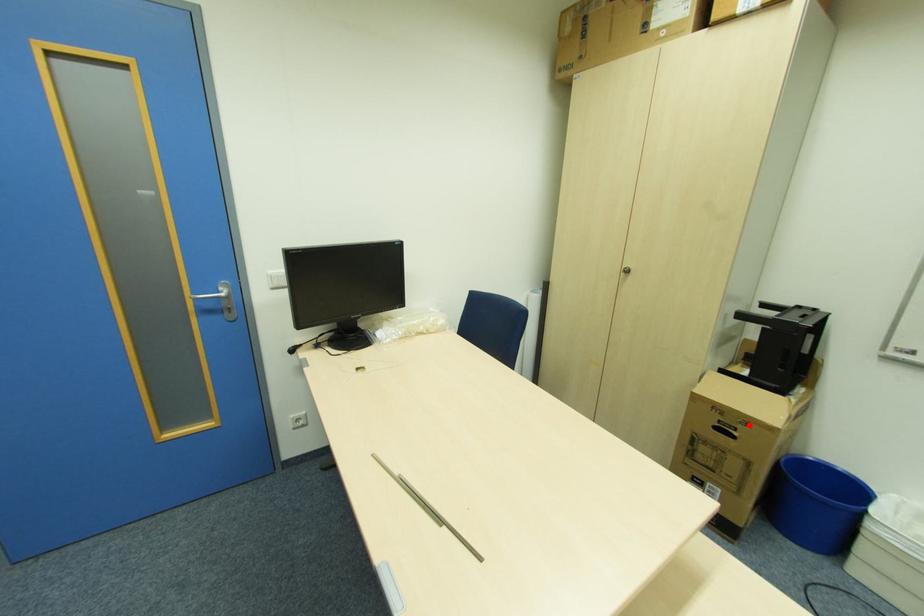
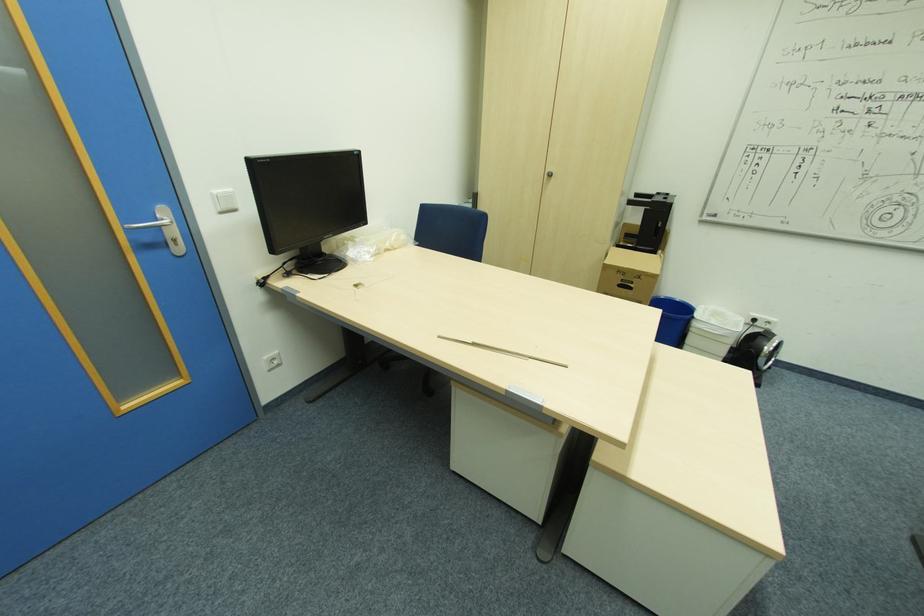
Where in the second image is the point corresponding to the highlighted location from the first image?

(641, 277)